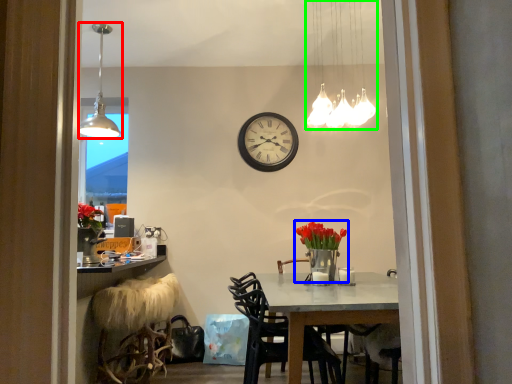
Question: Considering the real-world distances, which object is closest to lamp (highlighted by a red box)? floral arrangement (highlighted by a blue box) or lamp (highlighted by a green box).

Choices:
 (A) floral arrangement
 (B) lamp

Answer: (B)